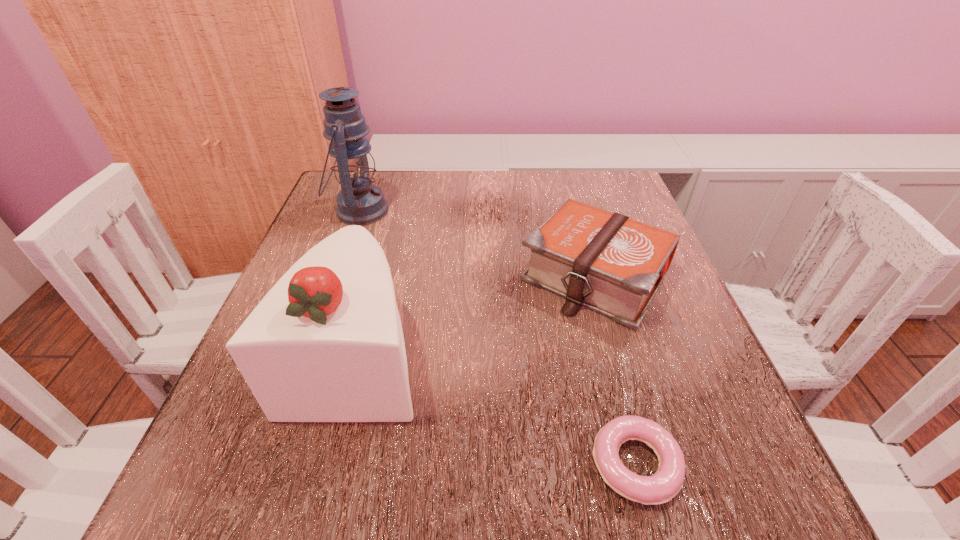
Locate an element on the screen. The width and height of the screenshot is (960, 540). free point that satisfies the following two spatial constraints: 1. on the front-facing side of the lantern; 2. on the back side of the second shortest object is located at coordinates (336, 276).

This screenshot has width=960, height=540. What are the coordinates of `vacant area in the image that satisfies the following two spatial constraints: 1. on the front-facing side of the nearest object; 2. on the left side of the lantern` in the screenshot? It's located at (268, 464).